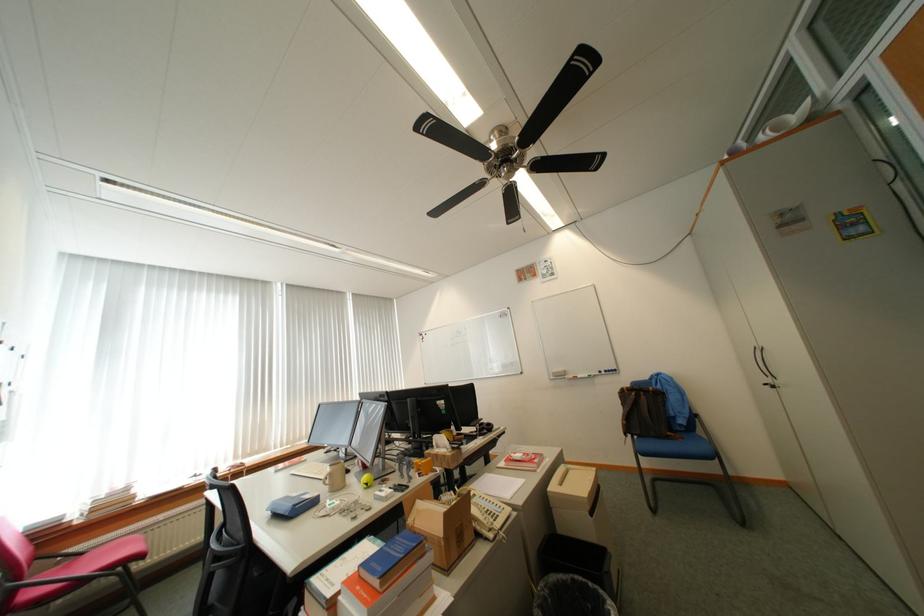
The height and width of the screenshot is (616, 924). Find the location of `blue hardcover book`. blue hardcover book is located at coordinates (392, 559).